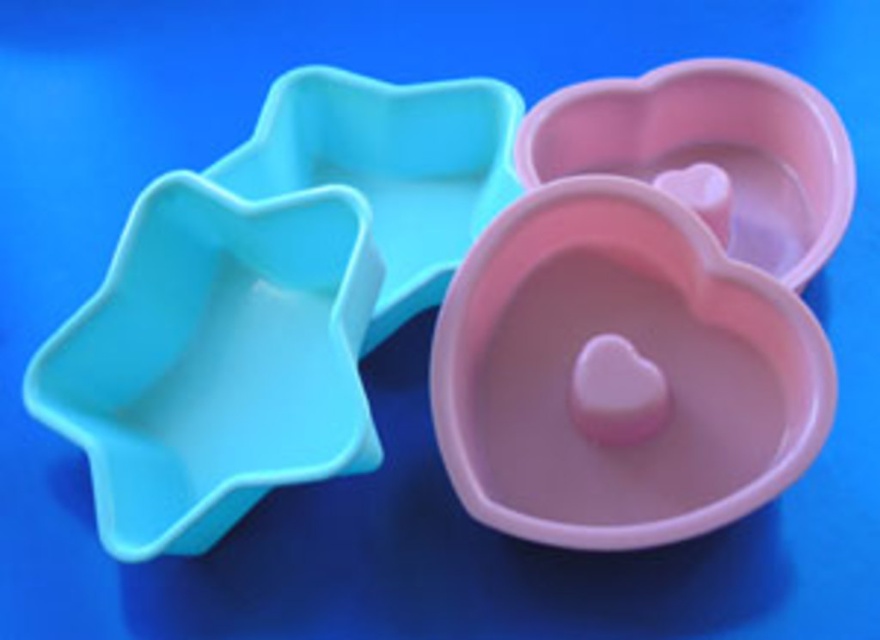
Question: Which point is farther to the camera?

Choices:
 (A) pink matte heart-shaped bowl at upper right
 (B) matte blue star at upper left

Answer: (A)

Question: Is pink matte heart-shaped bowl at center positioned at the back of matte blue star bowl at left?

Choices:
 (A) no
 (B) yes

Answer: (A)

Question: Among these points, which one is nearest to the camera?

Choices:
 (A) (345, 388)
 (B) (796, 234)
 (C) (704, 253)
 (D) (298, 134)

Answer: (C)

Question: Can you confirm if pink matte heart-shaped bowl at center is positioned above pink matte heart-shaped bowl at upper right?

Choices:
 (A) yes
 (B) no

Answer: (B)

Question: Which object is the closest to the pink matte heart-shaped bowl at upper right?

Choices:
 (A) matte blue star at upper left
 (B) matte blue star bowl at left
 (C) pink matte heart-shaped bowl at center

Answer: (C)

Question: Does matte blue star at upper left appear on the left side of pink matte heart-shaped bowl at upper right?

Choices:
 (A) no
 (B) yes

Answer: (B)